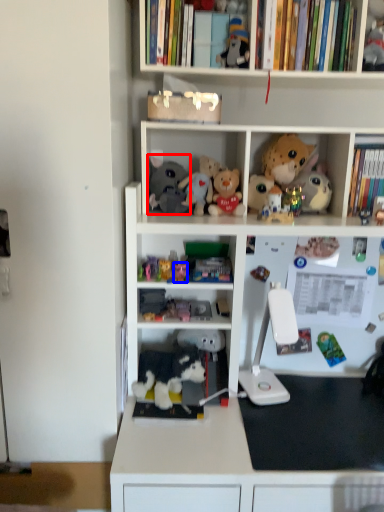
Question: Which of the following is the closest to the observer, toy (highlighted by a red box) or toy (highlighted by a blue box)?

Choices:
 (A) toy
 (B) toy

Answer: (B)